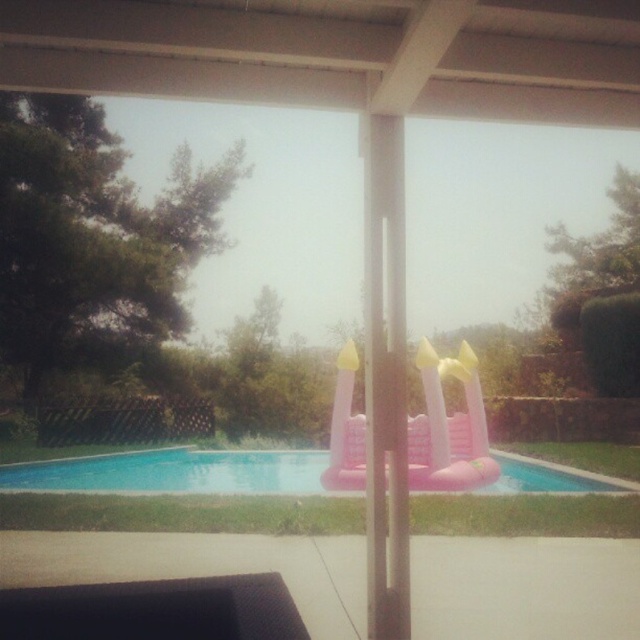
Is pink inflatable castle at center positioned at the back of pink inflatable slide at center?

No.

Measure the distance between pink inflatable castle at center and camera.

pink inflatable castle at center and camera are 23.87 feet apart.

Image resolution: width=640 pixels, height=640 pixels. What are the coordinates of `pink inflatable castle at center` in the screenshot? It's located at (173, 472).